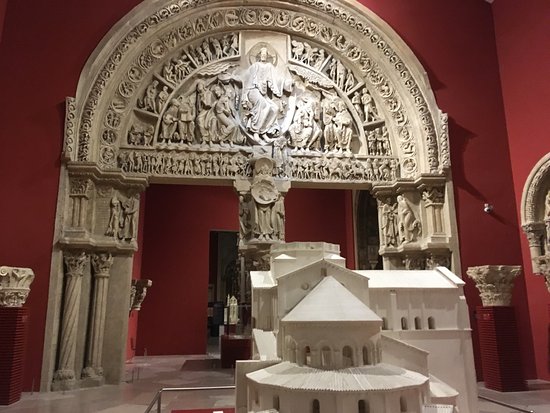
I want to click on stone archway over doorway, so click(x=255, y=92).